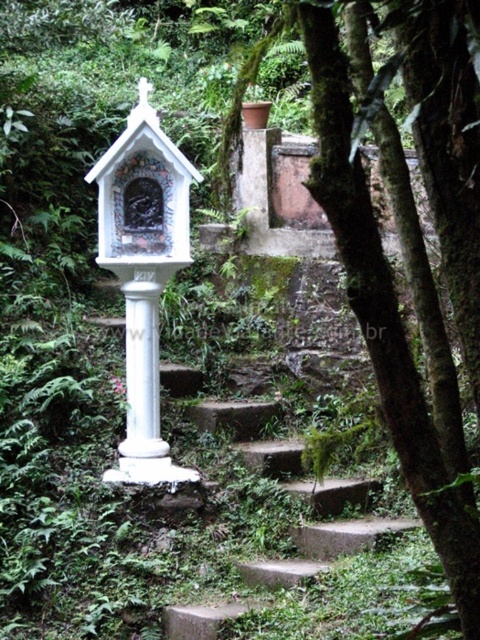
You are standing at the base of the stone steps leading to the shrine. You want to take a photo of the green mossy bark tree at center using a camera that has a maximum focus range of 10 meters. Will the camera be able to focus on the tree?

The green mossy bark tree at center and camera are 10.15 meters apart. Since the camera can only focus up to 10 meters, the distance is too far for the camera to focus on the tree.

You are a bird looking for a place to perch. You see a green mossy bark tree at center and a white painted wood bird feeder at center. Which one is smaller and better for your small size?

The green mossy bark tree at center is smaller than the white painted wood bird feeder at center, so it is better for your small size.

You are a bird looking for a place to perch. You see a green mossy bark tree at center and a white painted wood bird feeder at center. Which one is lower to the ground?

The green mossy bark tree at center is located below the white painted wood bird feeder at center, so it is lower to the ground.